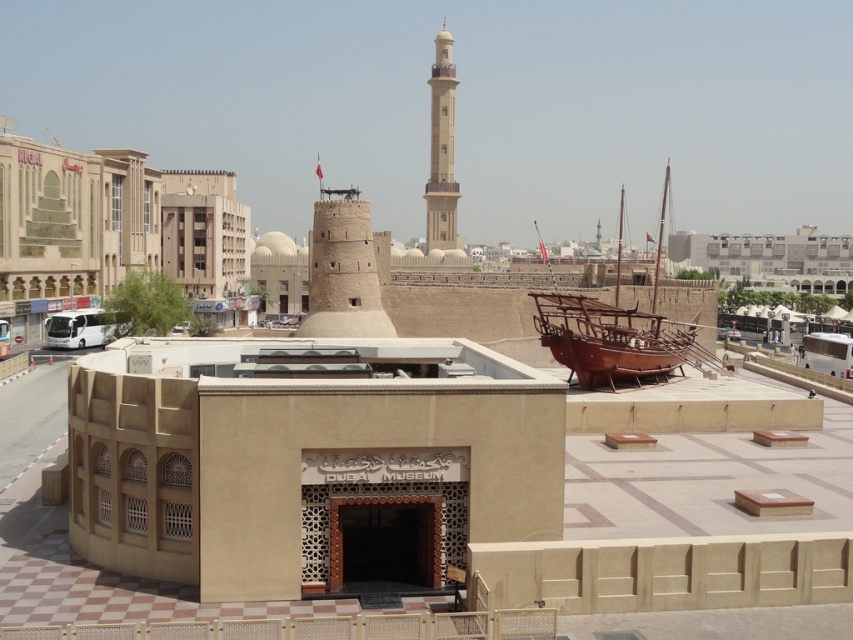
Question: Observing the image, what is the correct spatial positioning of rustic wood boat at center-right in reference to beige stone minaret at center?

Choices:
 (A) right
 (B) left

Answer: (A)

Question: Is rustic wood boat at center-right to the right of beige stone minaret at center from the viewer's perspective?

Choices:
 (A) yes
 (B) no

Answer: (A)

Question: Which point is closer to the camera?

Choices:
 (A) (592, 300)
 (B) (430, 176)

Answer: (A)

Question: Considering the relative positions of rustic wood boat at center-right and beige stone minaret at center in the image provided, where is rustic wood boat at center-right located with respect to beige stone minaret at center?

Choices:
 (A) right
 (B) left

Answer: (A)